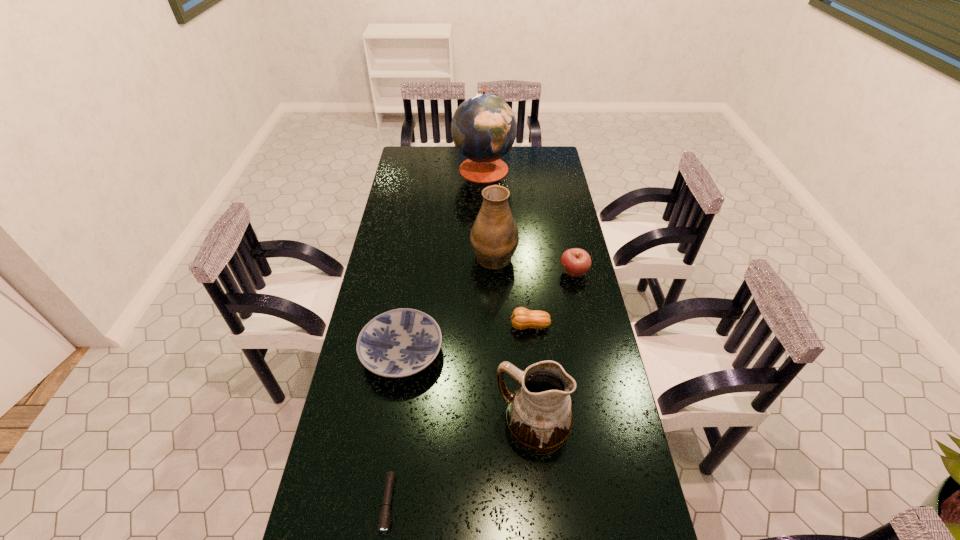
The height and width of the screenshot is (540, 960). In order to click on free location located 0.190m on the side of the rightmost object with the unique marking in this screenshot , I will do `click(509, 273)`.

At what (x,y) coordinates should I click in order to perform the action: click on vacant area located on the side of the rightmost object with the unique marking. Please return your answer as a coordinate pair (x, y). This screenshot has width=960, height=540. Looking at the image, I should click on (454, 273).

Find the location of a particular element. free spot located on the stem side of the gourd is located at coordinates (449, 326).

Find the location of a particular element. This screenshot has height=540, width=960. vacant space situated on the stem side of the gourd is located at coordinates (399, 326).

In order to click on vacant region located on the stem side of the gourd in this screenshot , I will do `click(467, 326)`.

Identify the location of free spot located on the front of the plate. The height and width of the screenshot is (540, 960). (380, 499).

At what (x,y) coordinates should I click in order to perform the action: click on object positioned at the far edge. Please return your answer as a coordinate pair (x, y). Looking at the image, I should click on (483, 127).

At what (x,y) coordinates should I click in order to perform the action: click on plate located in the left edge section of the desktop. Please return your answer as a coordinate pair (x, y). The width and height of the screenshot is (960, 540). Looking at the image, I should click on (398, 343).

Identify the location of flashlight that is at the left edge. The image size is (960, 540). (384, 520).

Identify the location of pitcher situated at the right edge. (539, 415).